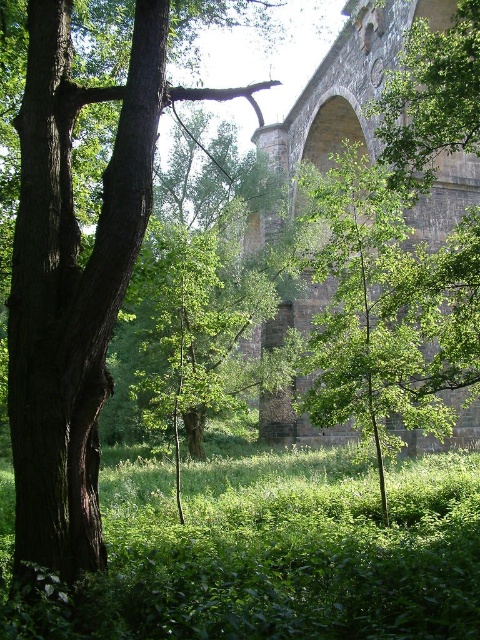
Question: Is green leafy grass at center to the left of dark brown bark tree at left from the viewer's perspective?

Choices:
 (A) yes
 (B) no

Answer: (B)

Question: Which of the following is the farthest from the observer?

Choices:
 (A) (103, 282)
 (B) (380, 19)
 (C) (144, 502)

Answer: (B)

Question: Estimate the real-world distances between objects in this image. Which object is farther from the green leafy grass at center?

Choices:
 (A) dark brown bark tree at left
 (B) stone arch bridge at center

Answer: (B)

Question: Can you confirm if dark brown bark tree at left is positioned to the right of stone arch bridge at center?

Choices:
 (A) no
 (B) yes

Answer: (A)

Question: Which of the following is the closest to the observer?

Choices:
 (A) (21, 515)
 (B) (156, 548)

Answer: (A)

Question: Can you confirm if green leafy grass at center is bigger than stone arch bridge at center?

Choices:
 (A) yes
 (B) no

Answer: (B)